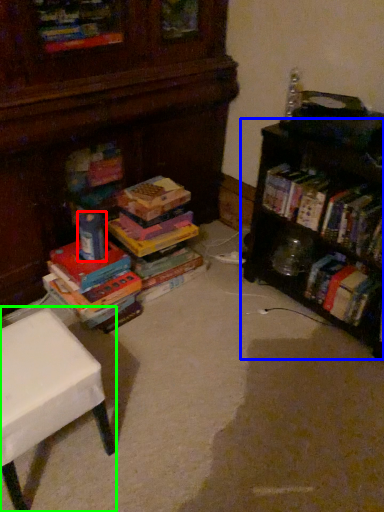
Question: Based on their relative distances, which object is farther from toy (highlighted by a red box)? Choose from shelf (highlighted by a blue box) and table (highlighted by a green box).

Choices:
 (A) shelf
 (B) table

Answer: (A)